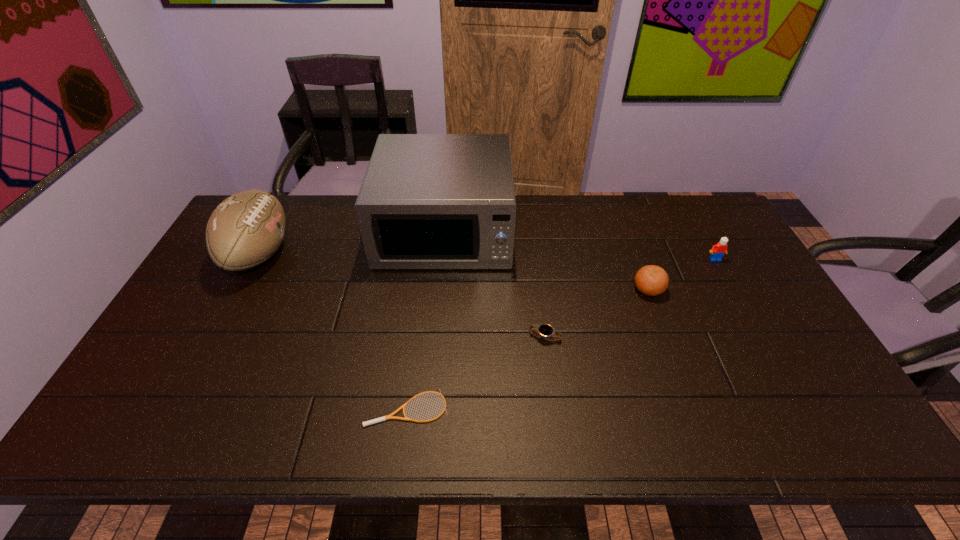
The image size is (960, 540). I want to click on unoccupied area between the microwave oven and the football (American), so click(352, 242).

Find the location of a particular element. blank region between the nearest object and the Lego is located at coordinates (561, 334).

Find the location of a particular element. Image resolution: width=960 pixels, height=540 pixels. vacant area that lies between the tennis racket and the fifth farthest object is located at coordinates (476, 373).

In order to click on free spot between the leftmost object and the tennis racket in this screenshot , I will do `click(333, 331)`.

This screenshot has width=960, height=540. In order to click on free space between the fifth shortest object and the fifth farthest object in this screenshot , I will do `click(402, 295)`.

Where is `unoccupied area between the third shortest object and the shortest object`? unoccupied area between the third shortest object and the shortest object is located at coordinates (528, 349).

At what (x,y) coordinates should I click in order to perform the action: click on free space between the leftmost object and the nearest object. Please return your answer as a coordinate pair (x, y). The image size is (960, 540). Looking at the image, I should click on (333, 331).

Locate an element on the screen. Image resolution: width=960 pixels, height=540 pixels. the fifth closest object to the shortest object is located at coordinates (718, 250).

The width and height of the screenshot is (960, 540). I want to click on object that is the second nearest to the second object from right to left, so click(x=545, y=331).

Locate an element on the screen. The height and width of the screenshot is (540, 960). free spot that satisfies the following two spatial constraints: 1. with the door open on the tallest object; 2. on the laces of the football (American) is located at coordinates (443, 254).